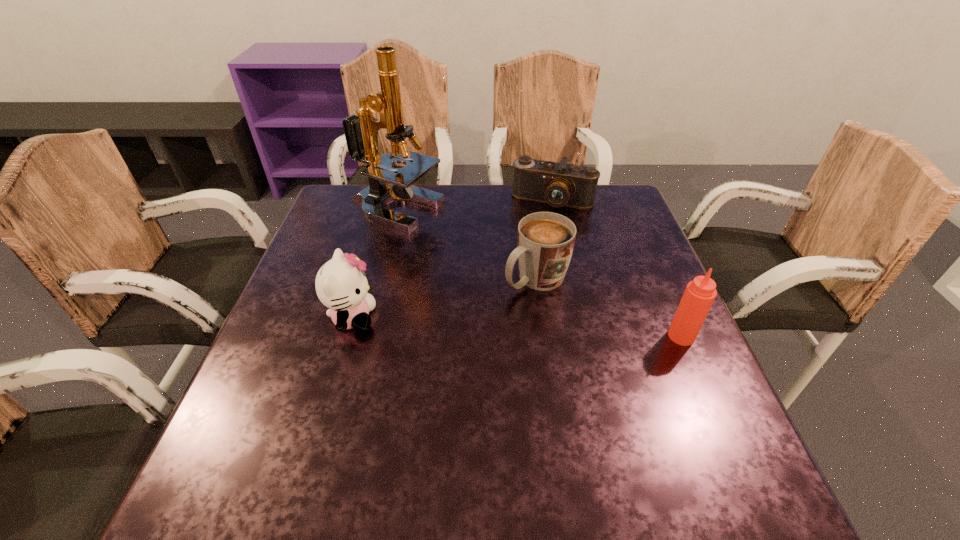
Identify the location of free space on the desktop that is between the kitten and the Tabasco sauce and is positioned on the side of the mug with the handle. The image size is (960, 540). (469, 325).

What are the coordinates of `free spot on the desktop that is between the kitten and the Tabasco sauce and is positioned at the eyepiece of the tallest object` in the screenshot? It's located at (532, 328).

The image size is (960, 540). Identify the location of free space on the desktop that is between the kitten and the rightmost object and is positioned on the lens of the camera. (510, 327).